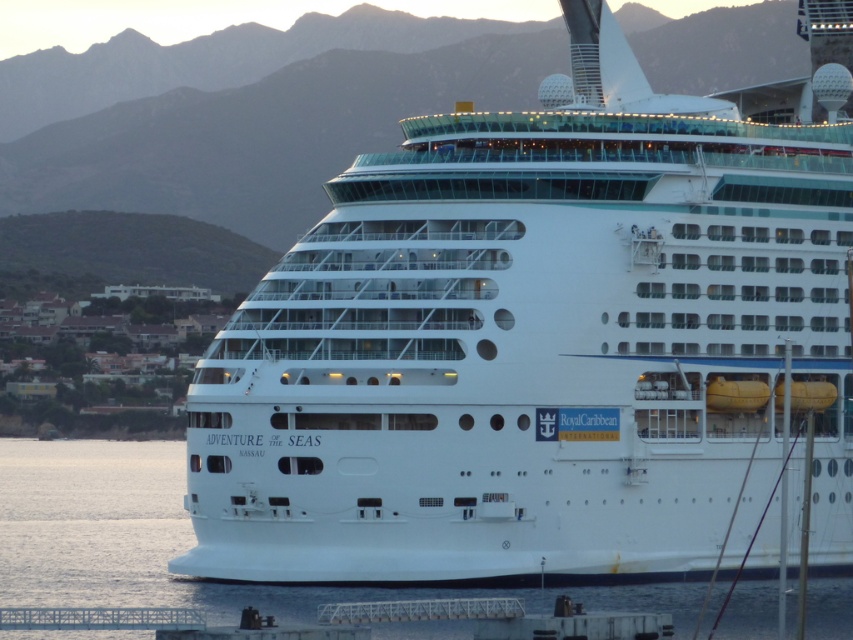
Question: Among these objects, which one is nearest to the camera?

Choices:
 (A) white glossy cruise ship at center
 (B) clear water at lower center

Answer: (B)

Question: Can you confirm if white glossy cruise ship at center is positioned to the left of clear water at lower center?

Choices:
 (A) no
 (B) yes

Answer: (A)

Question: Does white glossy cruise ship at center have a greater width compared to clear water at lower center?

Choices:
 (A) no
 (B) yes

Answer: (A)

Question: Considering the relative positions of white glossy cruise ship at center and clear water at lower center in the image provided, where is white glossy cruise ship at center located with respect to clear water at lower center?

Choices:
 (A) left
 (B) right

Answer: (B)